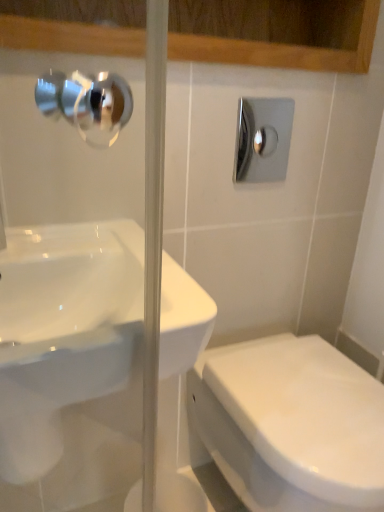
Question: Considering the relative sizes of white glossy toilet at lower right and polished chrome shower at upper right in the image provided, is white glossy toilet at lower right taller than polished chrome shower at upper right?

Choices:
 (A) no
 (B) yes

Answer: (B)

Question: Does white glossy toilet at lower right have a larger size compared to polished chrome shower at upper right?

Choices:
 (A) yes
 (B) no

Answer: (A)

Question: Is polished chrome shower at upper right surrounded by white glossy toilet at lower right?

Choices:
 (A) yes
 (B) no

Answer: (B)

Question: From the image's perspective, is white glossy toilet at lower right under polished chrome shower at upper right?

Choices:
 (A) yes
 (B) no

Answer: (A)

Question: Can you confirm if white glossy toilet at lower right is positioned to the left of polished chrome shower at upper right?

Choices:
 (A) yes
 (B) no

Answer: (B)

Question: Is white glossy toilet at lower right wider than polished chrome shower at upper right?

Choices:
 (A) no
 (B) yes

Answer: (B)

Question: From a real-world perspective, does white glossy sink at center stand above white glossy toilet at lower right?

Choices:
 (A) yes
 (B) no

Answer: (A)

Question: Would you consider white glossy sink at center to be distant from white glossy toilet at lower right?

Choices:
 (A) no
 (B) yes

Answer: (A)

Question: Is the position of white glossy sink at center less distant than that of white glossy toilet at lower right?

Choices:
 (A) no
 (B) yes

Answer: (B)

Question: Does white glossy sink at center have a smaller size compared to white glossy toilet at lower right?

Choices:
 (A) no
 (B) yes

Answer: (B)

Question: Can you confirm if white glossy sink at center is taller than white glossy toilet at lower right?

Choices:
 (A) no
 (B) yes

Answer: (A)

Question: From the image's perspective, is white glossy sink at center on top of white glossy toilet at lower right?

Choices:
 (A) no
 (B) yes

Answer: (B)

Question: Is white glossy toilet at lower right outside white glossy sink at center?

Choices:
 (A) no
 (B) yes

Answer: (B)